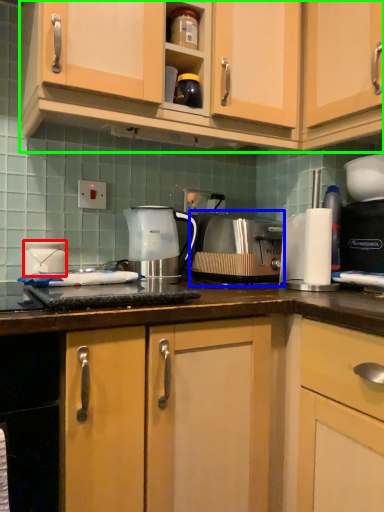
Question: Based on their relative distances, which object is farther from appliance (highlighted by a red box)? Choose from toaster (highlighted by a blue box) and cabinetry (highlighted by a green box).

Choices:
 (A) toaster
 (B) cabinetry

Answer: (B)